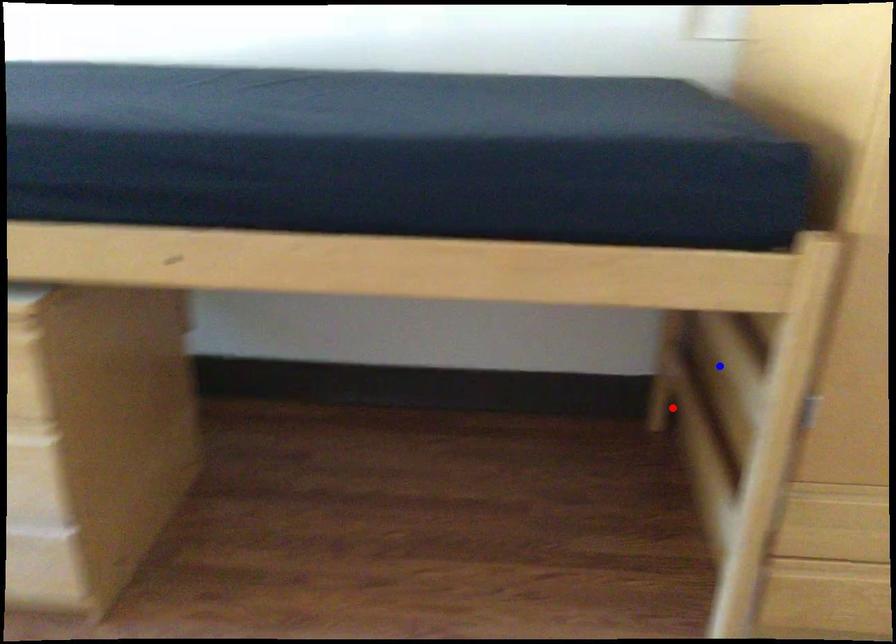
Question: Two points are marked on the image. Which point is closer to the camera?

Choices:
 (A) Blue point is closer.
 (B) Red point is closer.

Answer: (A)